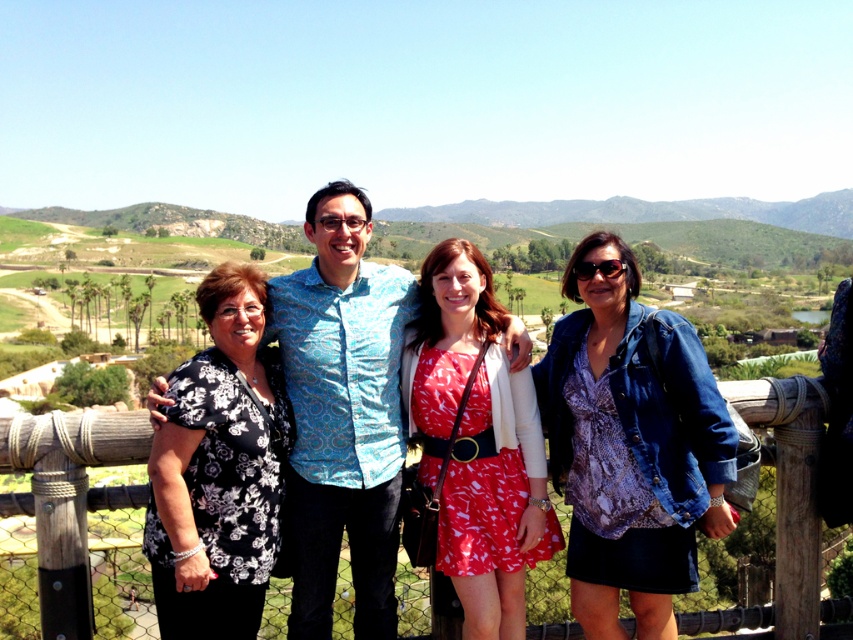
Does denim jacket at right have a lesser height compared to black floral blouse at left?

No, denim jacket at right is not shorter than black floral blouse at left.

Who is higher up, denim jacket at right or black floral blouse at left?

black floral blouse at left is above.

Is point (650, 404) in front of point (190, 392)?

No, it is behind (190, 392).

In order to click on denim jacket at right in this screenshot , I will do `click(630, 444)`.

Which is more to the left, denim jacket at right or blue patterned shirt at center?

blue patterned shirt at center

Can you confirm if denim jacket at right is wider than blue patterned shirt at center?

No.

Is point (706, 512) more distant than point (323, 198)?

No, it is not.

Locate an element on the screen. denim jacket at right is located at coordinates (630, 444).

Measure the distance between point [294,384] and camera.

The distance of point [294,384] from camera is 22.21 meters.

Who is taller, blue patterned shirt at center or wooden fence at center?

blue patterned shirt at center

Is point (354, 589) in front of point (39, 458)?

No, it is behind (39, 458).

Locate an element on the screen. This screenshot has height=640, width=853. blue patterned shirt at center is located at coordinates (341, 413).